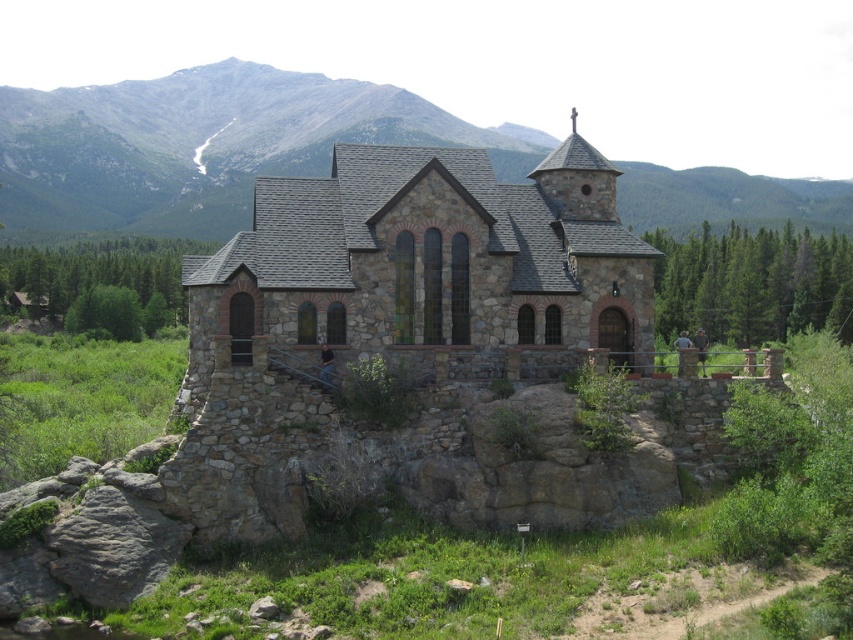
Which is behind, point (361, 93) or point (831, 243)?

The point (361, 93) is behind.

Can you confirm if gray stone mountain at upper center is thinner than green coniferous tree at right?

No.

Based on the photo, who is more distant from viewer, (x=695, y=216) or (x=827, y=301)?

The point (x=695, y=216) is behind.

Locate an element on the screen. This screenshot has height=640, width=853. gray stone mountain at upper center is located at coordinates (206, 145).

Is green coniferous tree at right taller than green leafy tree at left?

Yes, green coniferous tree at right is taller than green leafy tree at left.

Who is more forward, (820, 296) or (102, 256)?

Positioned in front is point (820, 296).

Where is `green coniferous tree at right`? green coniferous tree at right is located at coordinates (753, 284).

Between gray stone mountain at upper center and green leafy tree at left, which one is positioned lower?

green leafy tree at left

Which is above, gray stone mountain at upper center or green leafy tree at left?

gray stone mountain at upper center is above.

Is point (821, 212) positioned behind point (165, 257)?

Yes.

Where is `gray stone mountain at upper center`? gray stone mountain at upper center is located at coordinates (206, 145).